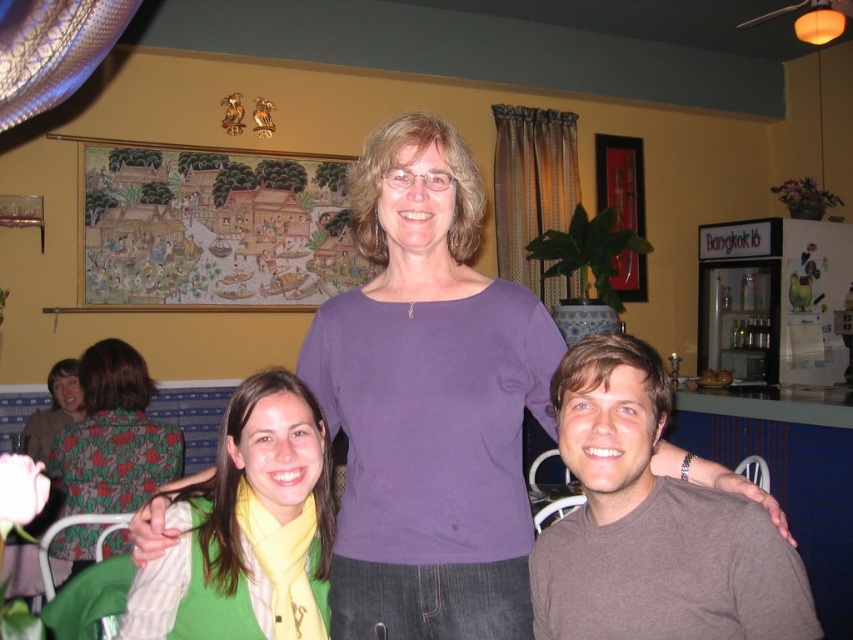
Does purple smooth shirt at center have a greater width compared to floral fabric dress at left?

Correct, the width of purple smooth shirt at center exceeds that of floral fabric dress at left.

In the scene shown: Which is more to the right, purple smooth shirt at center or floral fabric dress at left?

From the viewer's perspective, purple smooth shirt at center appears more on the right side.

Does point (409, 397) lie in front of point (141, 476)?

Yes, point (409, 397) is in front of point (141, 476).

Find the location of a particular element. purple smooth shirt at center is located at coordinates (428, 403).

Is brown cotton shirt at center bigger than floral fabric shirt at left?

No, brown cotton shirt at center is not bigger than floral fabric shirt at left.

Is point (613, 339) behind point (77, 376)?

That is False.

Is point (726, 499) behind point (77, 364)?

No, it is in front of (77, 364).

In order to click on brown cotton shirt at center in this screenshot , I will do `click(651, 524)`.

Is purple smooth shirt at center further to camera compared to brown cotton shirt at center?

That is True.

Is point (544, 312) farther from camera compared to point (577, 387)?

Yes.

Between point (395, 225) and point (634, 552), which one is positioned behind?

The point (395, 225) is more distant.

Locate an element on the screen. purple smooth shirt at center is located at coordinates (428, 403).